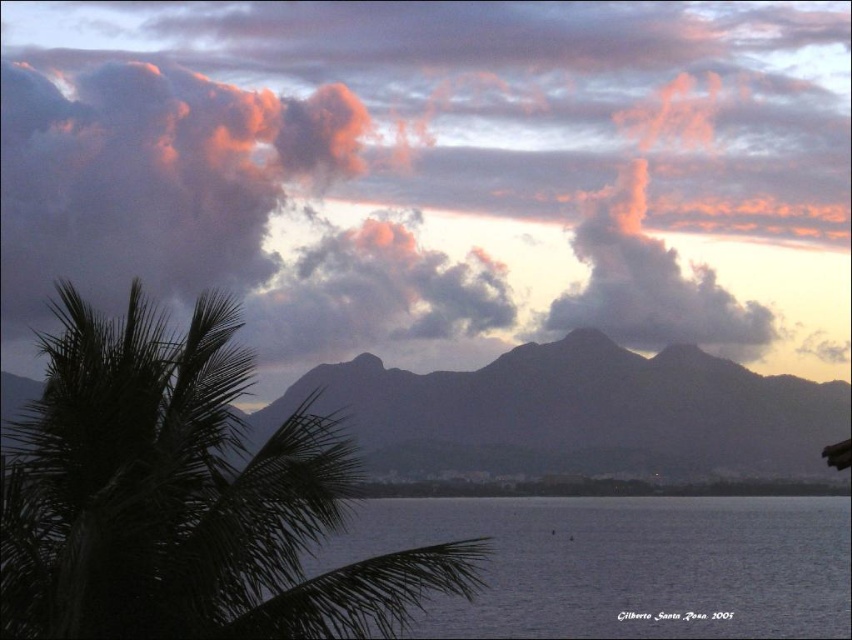
Which is in front, point (343, 468) or point (401, 384)?

Positioned in front is point (343, 468).

Is dark green leafy palm tree at left wider than silhouetted rock at center?

In fact, dark green leafy palm tree at left might be narrower than silhouetted rock at center.

Which is behind, point (263, 620) or point (655, 458)?

The point (655, 458) is behind.

Find the location of `dark green leafy palm tree at left`. dark green leafy palm tree at left is located at coordinates (185, 497).

Is pink fluffy cloud at upper center to the right of dark green leafy palm tree at left from the viewer's perspective?

No, pink fluffy cloud at upper center is not to the right of dark green leafy palm tree at left.

Does pink fluffy cloud at upper center appear on the left side of dark green leafy palm tree at left?

Indeed, pink fluffy cloud at upper center is positioned on the left side of dark green leafy palm tree at left.

You are a GUI agent. You are given a task and a screenshot of the screen. Output one action in this format:
    pyautogui.click(x=<x>, y=<y>)
    Task: Click on the pink fluffy cloud at upper center
    This screenshot has height=640, width=852.
    Given the screenshot: What is the action you would take?
    pyautogui.click(x=436, y=173)

Who is positioned more to the left, transparent blue water at center or silhouetted rock at center?

From the viewer's perspective, silhouetted rock at center appears more on the left side.

Is transparent blue water at center further to the viewer compared to silhouetted rock at center?

No, it is not.

This screenshot has width=852, height=640. In order to click on transparent blue water at center in this screenshot , I will do `click(623, 563)`.